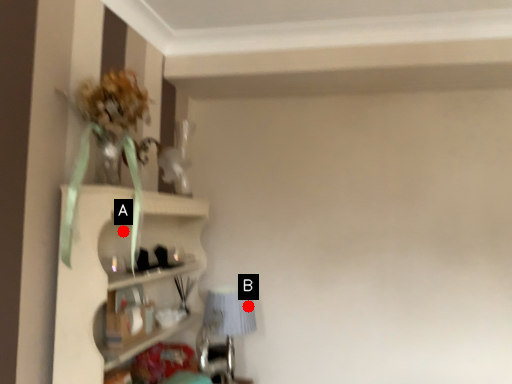
Question: Two points are circled on the image, labeled by A and B beside each circle. Which point is further to the camera?

Choices:
 (A) A is further
 (B) B is further

Answer: (B)